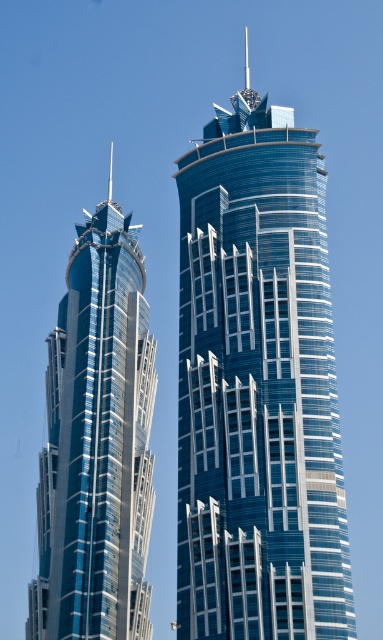
Question: Is transparent glass tower at center above glossy glass skyscraper at left?

Choices:
 (A) yes
 (B) no

Answer: (A)

Question: Does transparent glass tower at center appear over glossy glass skyscraper at left?

Choices:
 (A) yes
 (B) no

Answer: (A)

Question: Is the position of transparent glass tower at center less distant than that of glossy glass skyscraper at left?

Choices:
 (A) yes
 (B) no

Answer: (A)

Question: Among these points, which one is farthest from the camera?

Choices:
 (A) (256, 305)
 (B) (111, 545)

Answer: (B)

Question: Which of the following is the farthest from the observer?

Choices:
 (A) (317, 360)
 (B) (109, 362)

Answer: (B)

Question: Among these objects, which one is nearest to the camera?

Choices:
 (A) glossy glass skyscraper at left
 (B) transparent glass tower at center

Answer: (B)